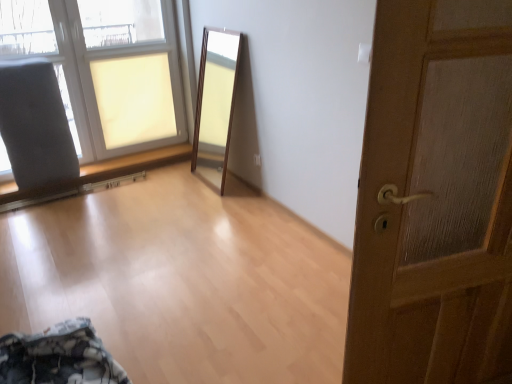
Question: Is matte glass window at upper left not close to wooden door at right?

Choices:
 (A) no
 (B) yes

Answer: (B)

Question: Considering the relative positions of matte glass window at upper left and wooden door at right in the image provided, is matte glass window at upper left to the right of wooden door at right from the viewer's perspective?

Choices:
 (A) yes
 (B) no

Answer: (B)

Question: Would you say matte glass window at upper left is outside wooden door at right?

Choices:
 (A) no
 (B) yes

Answer: (B)

Question: Can you confirm if matte glass window at upper left is smaller than wooden door at right?

Choices:
 (A) yes
 (B) no

Answer: (B)

Question: Is matte glass window at upper left at the left side of wooden door at right?

Choices:
 (A) no
 (B) yes

Answer: (B)

Question: Does matte glass window at upper left turn towards wooden door at right?

Choices:
 (A) no
 (B) yes

Answer: (B)

Question: From the image's perspective, is matte glass window at upper left above gray fabric armchair at left?

Choices:
 (A) yes
 (B) no

Answer: (A)

Question: Considering the relative sizes of matte glass window at upper left and gray fabric armchair at left in the image provided, is matte glass window at upper left smaller than gray fabric armchair at left?

Choices:
 (A) no
 (B) yes

Answer: (A)

Question: Is matte glass window at upper left to the right of gray fabric armchair at left from the viewer's perspective?

Choices:
 (A) yes
 (B) no

Answer: (A)

Question: Is the position of matte glass window at upper left more distant than that of gray fabric armchair at left?

Choices:
 (A) no
 (B) yes

Answer: (A)

Question: From a real-world perspective, is matte glass window at upper left positioned under gray fabric armchair at left based on gravity?

Choices:
 (A) no
 (B) yes

Answer: (A)

Question: Can you confirm if matte glass window at upper left is thinner than gray fabric armchair at left?

Choices:
 (A) yes
 (B) no

Answer: (A)

Question: Can you confirm if wooden door at right is wider than gray fabric armchair at left?

Choices:
 (A) no
 (B) yes

Answer: (A)